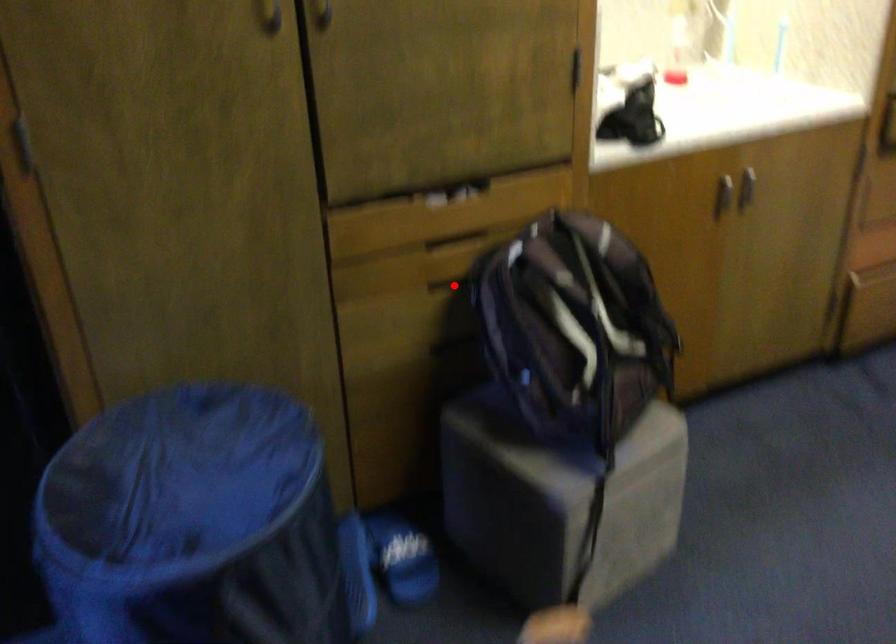
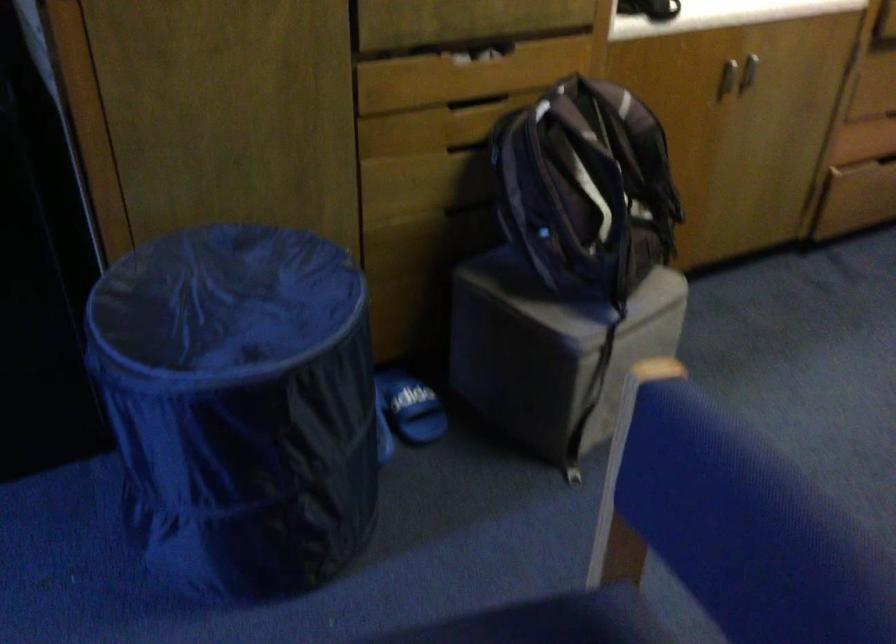
Find the pixel in the second image that matches the highlighted location in the first image.

(471, 144)